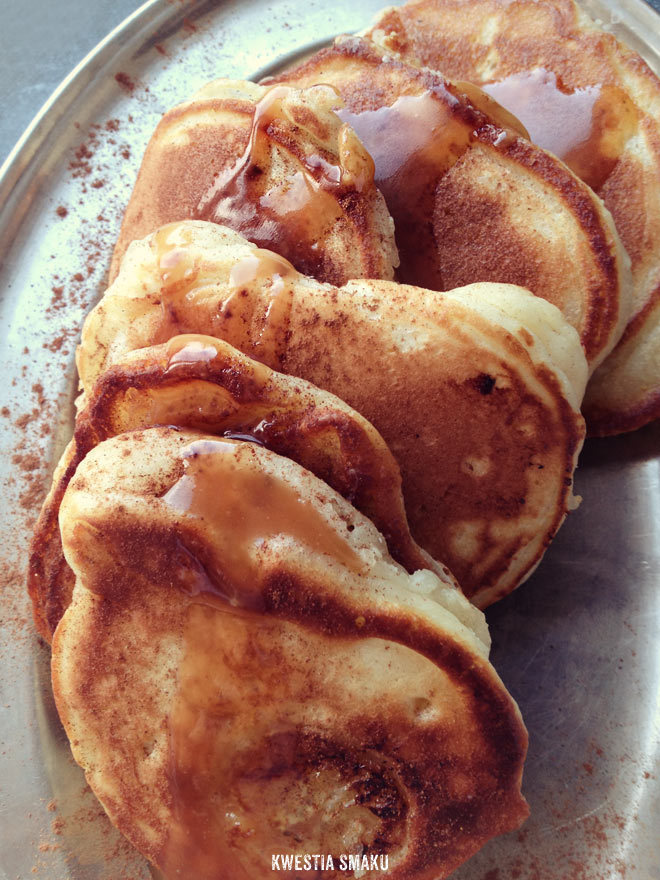
Identify the location of rim of plate. Image resolution: width=660 pixels, height=880 pixels. (49, 100).